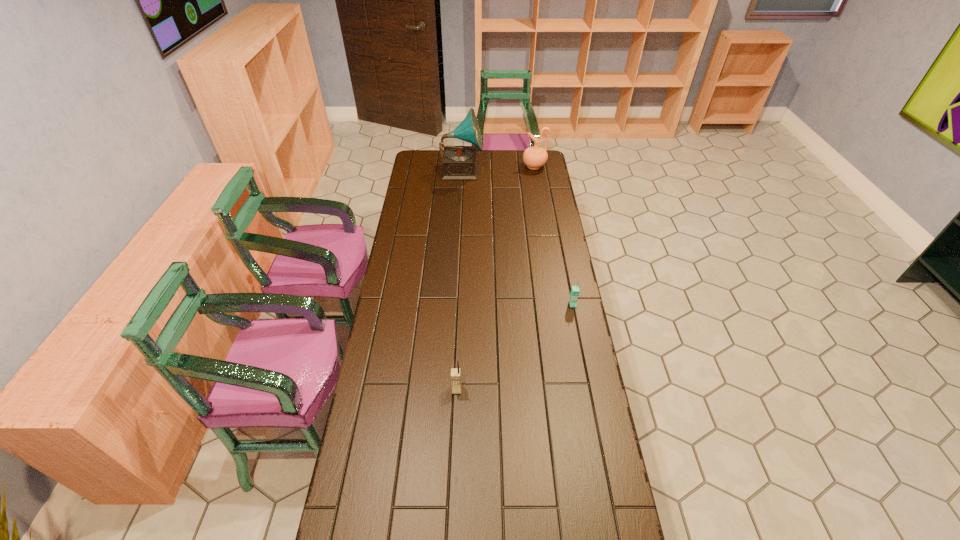
Where is `record player`? record player is located at coordinates coord(460,163).

Identify the location of pottery. (535, 157).

Find the location of a particular element. the taller cellular telephone is located at coordinates (455, 372).

Image resolution: width=960 pixels, height=540 pixels. Find the location of `the left cellular telephone`. the left cellular telephone is located at coordinates (455, 372).

Where is `the shorter cellular telephone`? This screenshot has height=540, width=960. the shorter cellular telephone is located at coordinates (574, 294).

The image size is (960, 540). Find the location of `the right cellular telephone`. the right cellular telephone is located at coordinates (574, 294).

Locate an element on the screen. The width and height of the screenshot is (960, 540). vacant space located 0.340m on the horn of the tallest object is located at coordinates point(543,170).

Image resolution: width=960 pixels, height=540 pixels. I want to click on vacant space located on the spout of the second tallest object, so click(487, 166).

What are the coordinates of `vacant area situated 0.190m on the spout of the second tallest object` in the screenshot? It's located at (489, 166).

At what (x,y) coordinates should I click in order to perform the action: click on vacant space located on the spout of the second tallest object. Please return your answer as a coordinate pair (x, y). The height and width of the screenshot is (540, 960). Looking at the image, I should click on (470, 166).